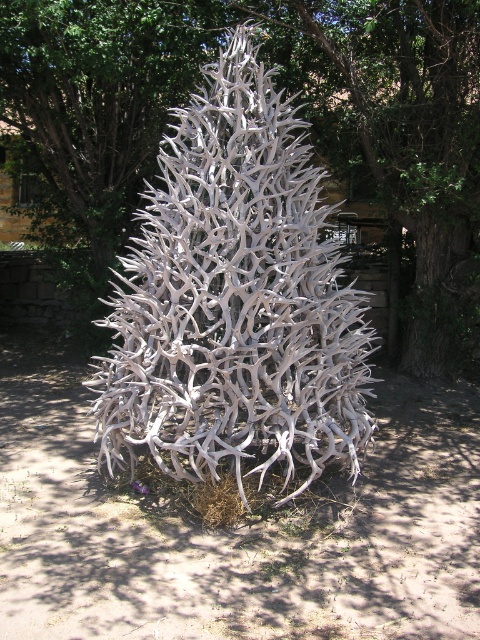
Question: Is white antler christmas tree at center wider than white antler at center?

Choices:
 (A) no
 (B) yes

Answer: (B)

Question: Does white antler christmas tree at center have a lesser width compared to white antler at center?

Choices:
 (A) yes
 (B) no

Answer: (B)

Question: Can you confirm if white antler christmas tree at center is positioned below white antler at center?

Choices:
 (A) yes
 (B) no

Answer: (A)